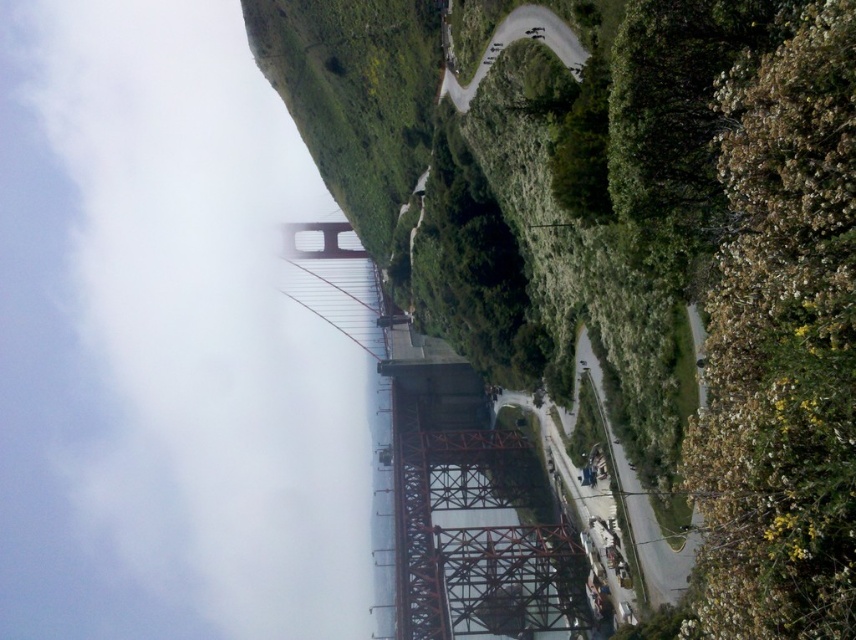
Question: Is white fluffy cloud at upper left wider than green grassy hillside at upper center?

Choices:
 (A) yes
 (B) no

Answer: (A)

Question: Is white fluffy cloud at upper left to the left of green grassy hillside at upper center from the viewer's perspective?

Choices:
 (A) no
 (B) yes

Answer: (B)

Question: Is white fluffy cloud at upper left above green grassy hillside at upper center?

Choices:
 (A) no
 (B) yes

Answer: (A)

Question: Which point is closer to the camera taking this photo?

Choices:
 (A) (248, 227)
 (B) (446, 84)

Answer: (B)